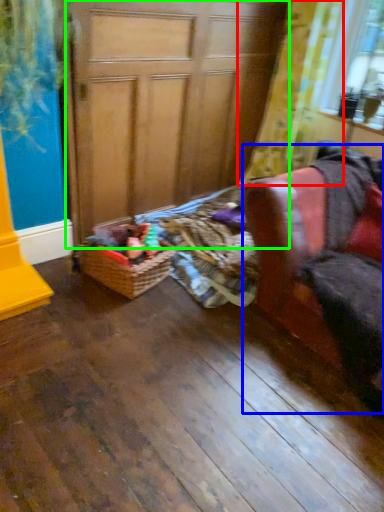
Question: Considering the real-world distances, which object is farthest from curtain (highlighted by a red box)? armchair (highlighted by a blue box) or screen door (highlighted by a green box)?

Choices:
 (A) armchair
 (B) screen door

Answer: (A)